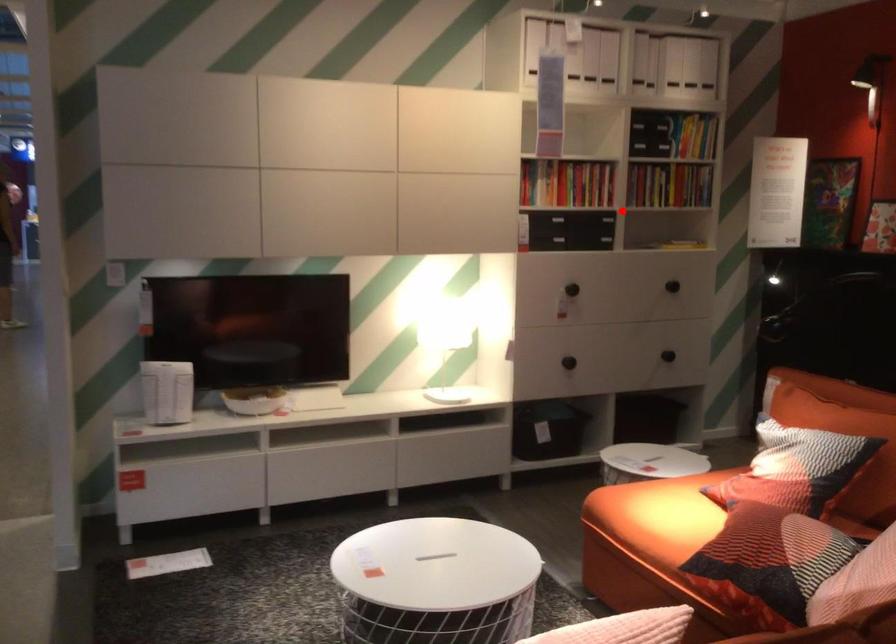
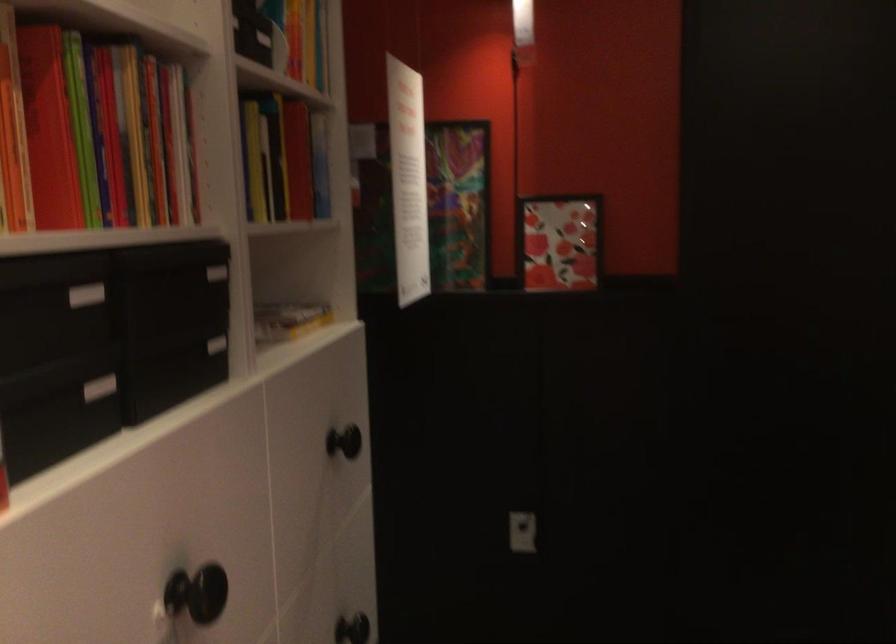
Locate, in the second image, the point that corresponds to the highlighted location in the first image.

(216, 345)